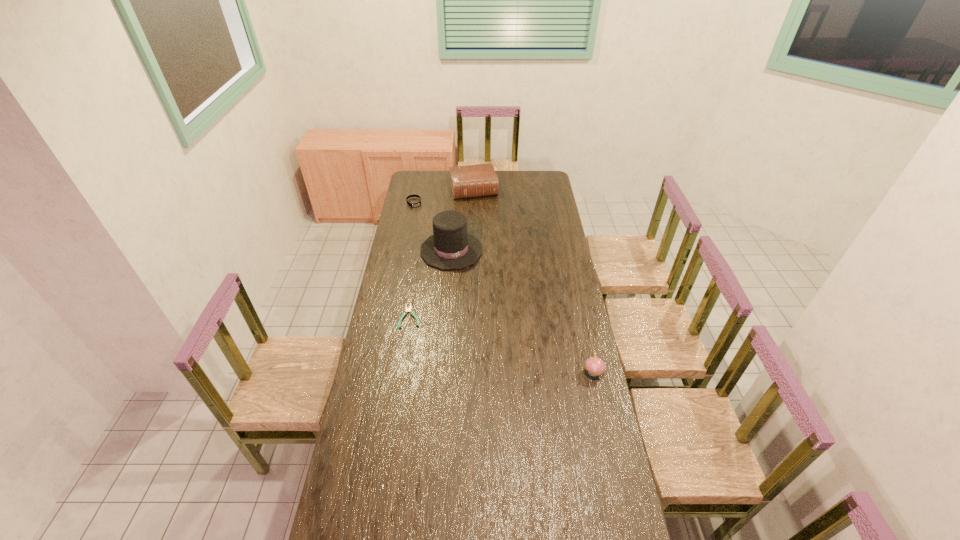
Locate an element on the screen. The height and width of the screenshot is (540, 960). pliers is located at coordinates (407, 309).

This screenshot has height=540, width=960. Find the location of `the second nearest object`. the second nearest object is located at coordinates (407, 309).

Locate an element on the screen. This screenshot has height=540, width=960. the rightmost object is located at coordinates (595, 366).

I want to click on cupcake, so click(x=595, y=366).

Where is `the tallest object`? the tallest object is located at coordinates (450, 247).

Where is `dress hat`? This screenshot has height=540, width=960. dress hat is located at coordinates (450, 247).

Identify the location of wristband. (419, 203).

Locate an element on the screen. Bible is located at coordinates (471, 181).

Where is `vacant space located on the left of the second nearest object`? The width and height of the screenshot is (960, 540). vacant space located on the left of the second nearest object is located at coordinates (389, 316).

I want to click on free location located on the left of the cupcake, so click(x=503, y=372).